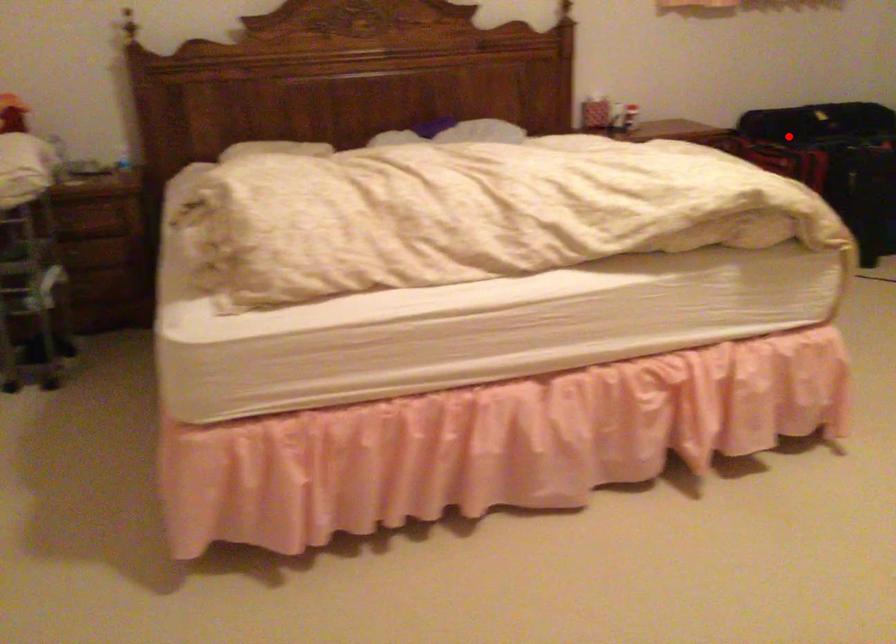
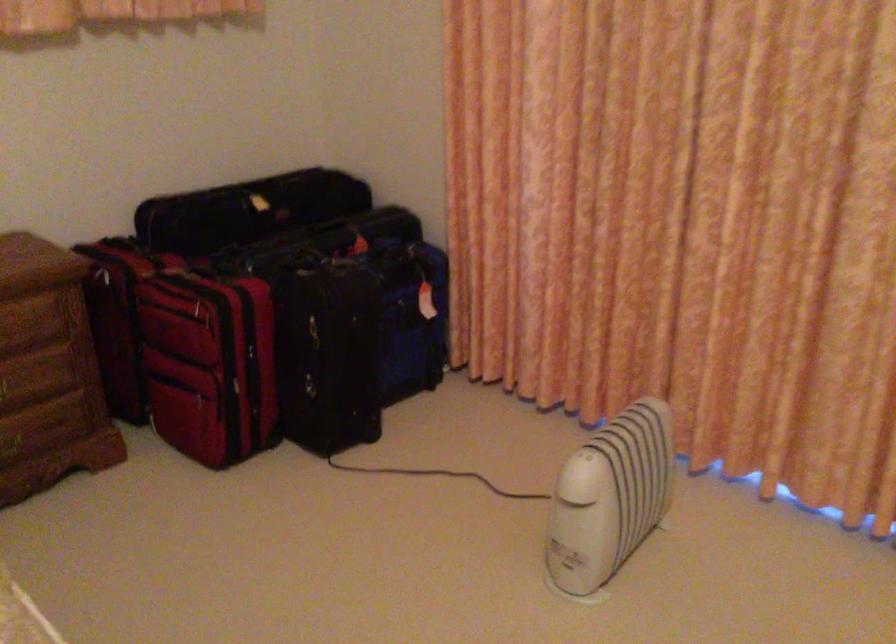
Question: I am providing you with two images of the same scene from different viewpoints. In image1, a red point is highlighted. Considering the same 3D point in image2, which of the following is correct?

Choices:
 (A) It is closer
 (B) It is farther

Answer: (A)